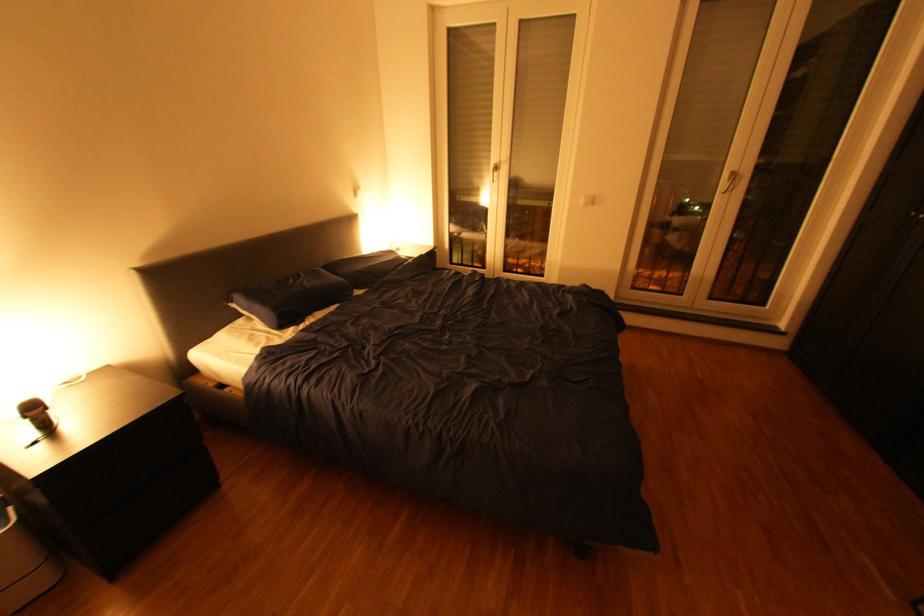
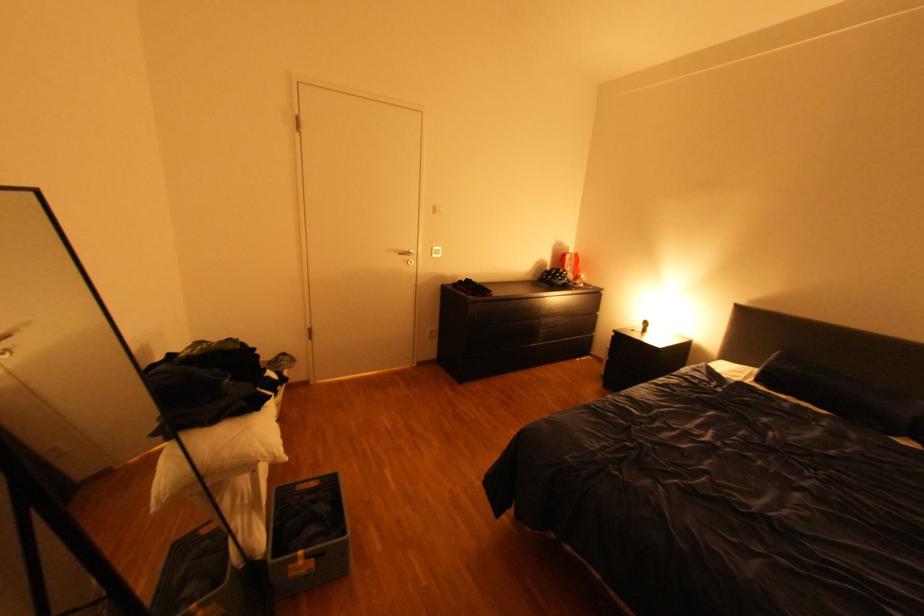
Locate, in the second image, the point that corresponds to (56,411) in the first image.

(659, 328)